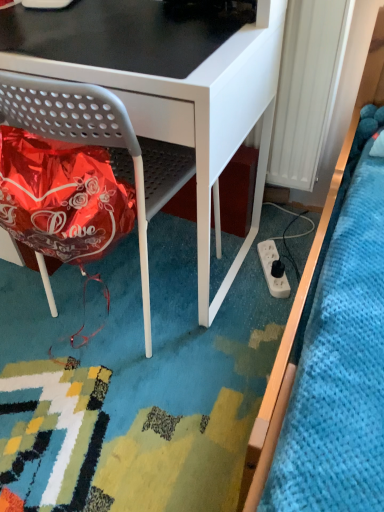
The height and width of the screenshot is (512, 384). In order to click on free space in front of white plastic power plugs and sockets at lower right in this screenshot , I will do `click(260, 312)`.